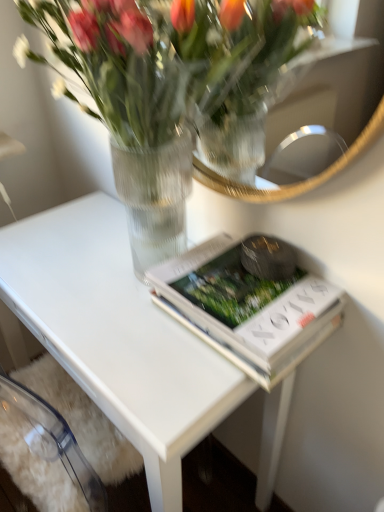
The height and width of the screenshot is (512, 384). I want to click on free area below clear glass vase at upper center (from a real-world perspective), so click(119, 270).